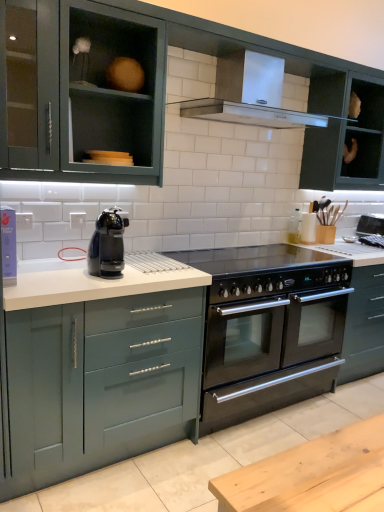
Find the location of `free space to the left of black plastic coffee machine at center`. free space to the left of black plastic coffee machine at center is located at coordinates (76, 272).